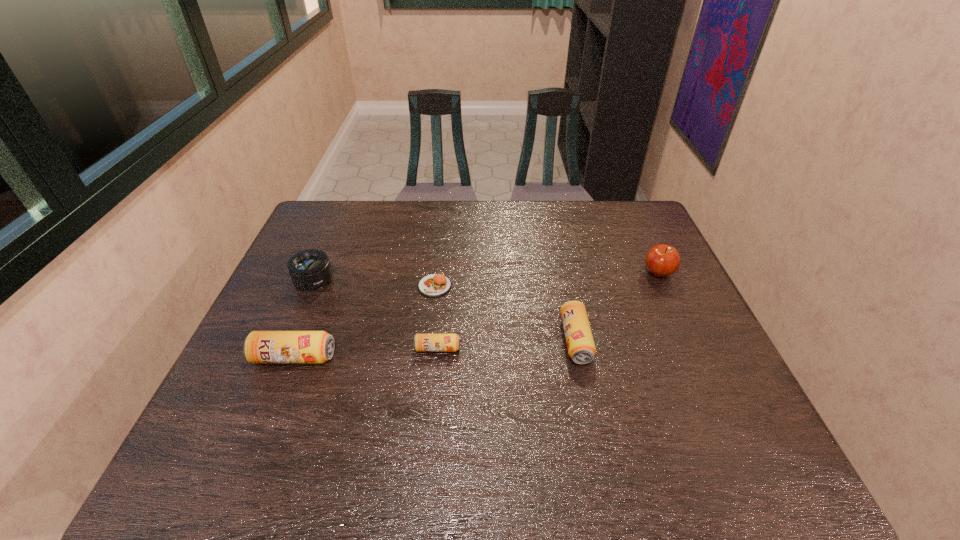
Image resolution: width=960 pixels, height=540 pixels. I want to click on vacant point that satisfies the following two spatial constraints: 1. on the side of the leftmost beer can with brand markings and control switches; 2. on the right side of the telephoto lens, so click(x=281, y=357).